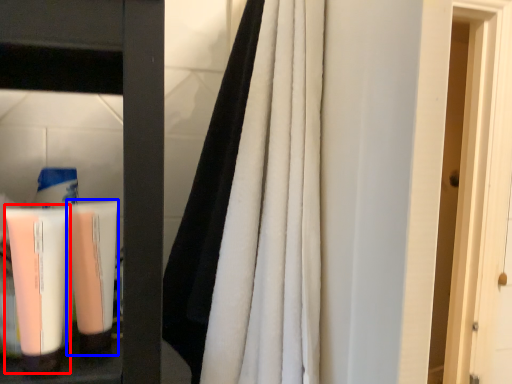
Question: Which object appears farthest to the camera in this image, cleaning product (highlighted by a red box) or shaving cream (highlighted by a blue box)?

Choices:
 (A) cleaning product
 (B) shaving cream

Answer: (B)